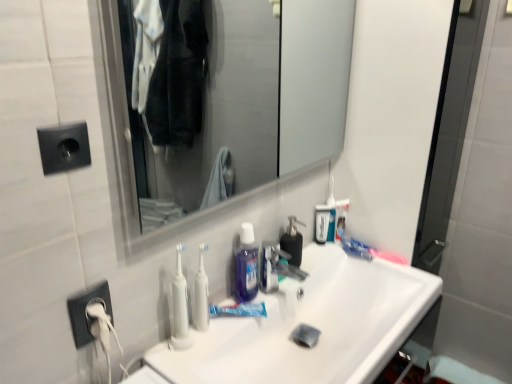
Where is `vacant space to the right of translucent purple mouthwash at center, positioned as the first mouthwash in left-to-right order`? The width and height of the screenshot is (512, 384). vacant space to the right of translucent purple mouthwash at center, positioned as the first mouthwash in left-to-right order is located at coordinates (221, 334).